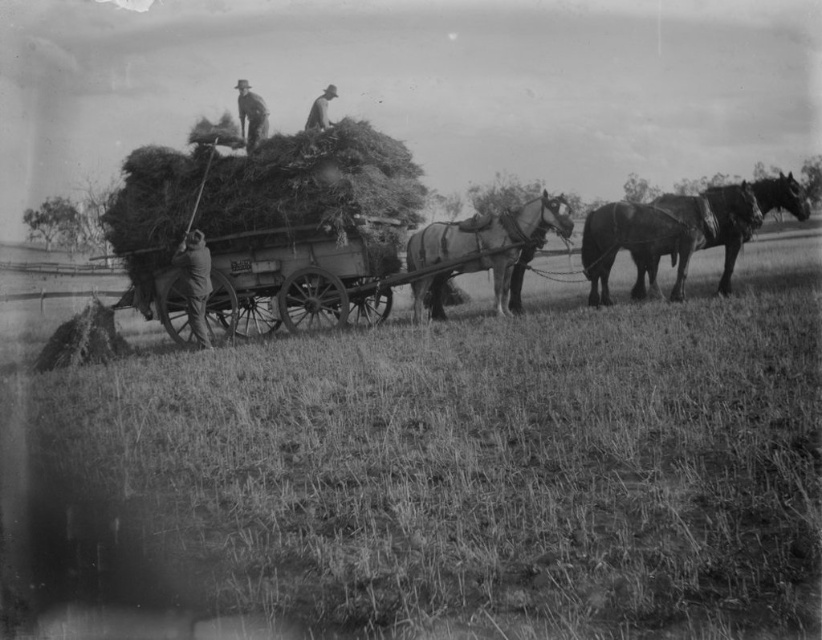
Does dark brown leather jacket at lower left appear under smooth brown hat at upper center?

Indeed, dark brown leather jacket at lower left is positioned under smooth brown hat at upper center.

Between point (188, 260) and point (248, 113), which one is positioned behind?

Positioned behind is point (248, 113).

In order to click on dark brown leather jacket at lower left in this screenshot , I will do `click(195, 282)`.

Which is above, dark brown leather jacket at lower left or light brown leather hat at upper center?

light brown leather hat at upper center

Is point (194, 333) less distant than point (313, 116)?

Yes, point (194, 333) is in front of point (313, 116).

I want to click on dark brown leather jacket at lower left, so pos(195,282).

Based on the photo, who is taller, grassy field at lower left or dark brown leather jacket at lower left?

Standing taller between the two is grassy field at lower left.

Between grassy field at lower left and dark brown leather jacket at lower left, which one is positioned higher?

dark brown leather jacket at lower left is above.

Which is in front, point (481, 438) or point (202, 257)?

Point (481, 438) is in front.

Where is `grassy field at lower left`? Image resolution: width=822 pixels, height=640 pixels. grassy field at lower left is located at coordinates (435, 472).